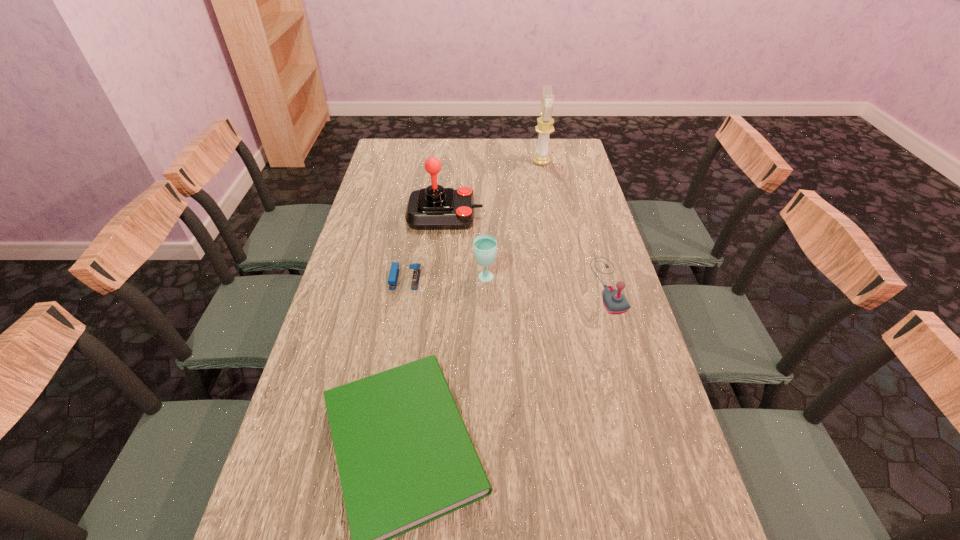
Identify the location of vacant space at the far edge. This screenshot has width=960, height=540. (459, 146).

In the image, there is a desktop. At what (x,y) coordinates should I click in order to perform the action: click on vacant region at the left edge. Please return your answer as a coordinate pair (x, y). This screenshot has height=540, width=960. Looking at the image, I should click on (379, 309).

Identify the location of free space at the right edge. Image resolution: width=960 pixels, height=540 pixels. (558, 176).

Locate an element on the screen. The image size is (960, 540). vacant space at the far left corner of the desktop is located at coordinates 415,145.

Locate an element on the screen. vacant space at the far right corner of the desktop is located at coordinates (579, 152).

Locate an element on the screen. The height and width of the screenshot is (540, 960). free space between the left joystick and the tallest object is located at coordinates (493, 189).

This screenshot has width=960, height=540. Identify the location of vacant space that is in between the second tallest object and the rightmost object. (526, 250).

At what (x,y) coordinates should I click in order to perform the action: click on free space between the right joystick and the farthest object. Please return your answer as a coordinate pair (x, y). This screenshot has height=540, width=960. Looking at the image, I should click on (575, 224).

At what (x,y) coordinates should I click in order to perform the action: click on vacant space that's between the third shortest object and the stapler. Please return your answer as a coordinate pair (x, y). This screenshot has height=540, width=960. Looking at the image, I should click on pos(507,282).

What are the coordinates of `free space between the rightmost object and the fifth object from left to right` in the screenshot? It's located at (575, 224).